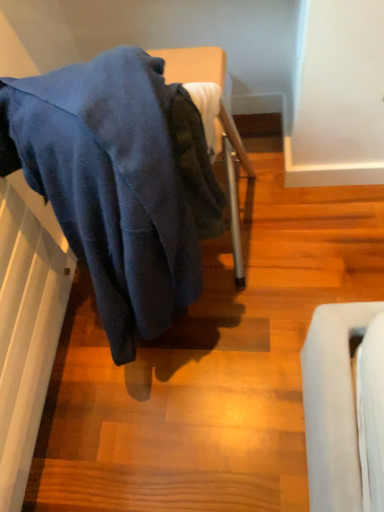
You are a GUI agent. You are given a task and a screenshot of the screen. Output one action in this format:
    pyautogui.click(x=<x>, y=<y>)
    Task: Click on the unoccupied region to the right of dark blue fabric at center
    The image size is (384, 512).
    Given the screenshot: What is the action you would take?
    pyautogui.click(x=301, y=247)